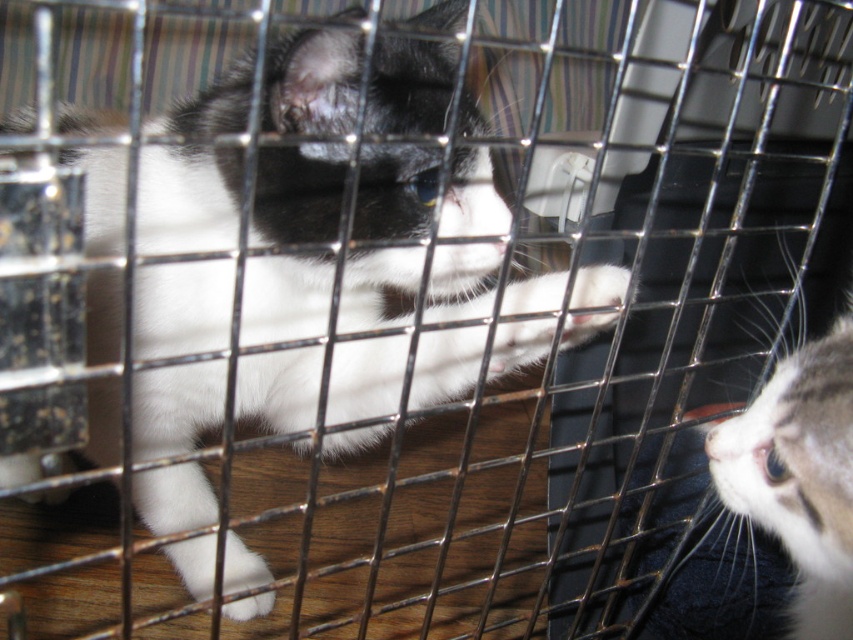
Based on the scene description, where is the soft fur cat at center located in terms of coordinates?

The soft fur cat at center is located at point coordinates of (300, 268).

You are a cat owner who wants to place a toy between the soft fur cat at center and the white fur cat at right. Since the cage bars are 10 cm apart, will the toy fit between them?

The soft fur cat at center is wider than the white fur cat at right. However, the cage bars are 10 cm apart, so the toy must be smaller than 10 cm to fit between them. The width of the cats does not affect the toy placement as the cage bars spacing determines the maximum toy size.